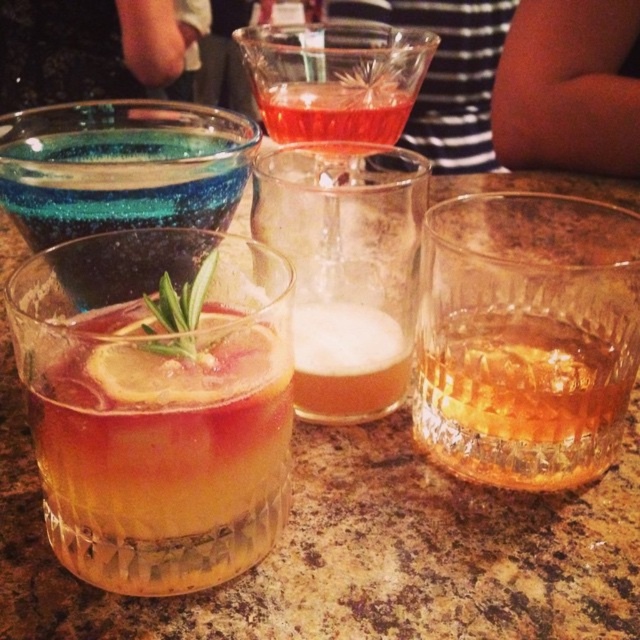
Who is more forward, [225,416] or [364,100]?

Point [225,416] is in front.

Is point (173, 528) in front of point (308, 42)?

Yes, it is.

Who is more forward, (x=112, y=465) or (x=262, y=77)?

Point (x=112, y=465)

Find the location of `translucent glass drink at center`. translucent glass drink at center is located at coordinates (157, 403).

Does amber glass at center have a greater width compared to foamy amber liquid at center?

Indeed, amber glass at center has a greater width compared to foamy amber liquid at center.

At what (x,y) coordinates should I click in order to perform the action: click on amber glass at center. Please return your answer as a coordinate pair (x, y). Image resolution: width=640 pixels, height=640 pixels. Looking at the image, I should click on (525, 337).

Identify the location of amber glass at center. (525, 337).

Consider the image. Can you confirm if translucent glass at center is bigger than foamy amber liquid at center?

Indeed, translucent glass at center has a larger size compared to foamy amber liquid at center.

Is translucent glass at center to the left of foamy amber liquid at center from the viewer's perspective?

Correct, you'll find translucent glass at center to the left of foamy amber liquid at center.

Is point (321, 285) positioned behind point (330, 360)?

No, it is in front of (330, 360).

This screenshot has height=640, width=640. Identify the location of translucent glass at center. (346, 268).